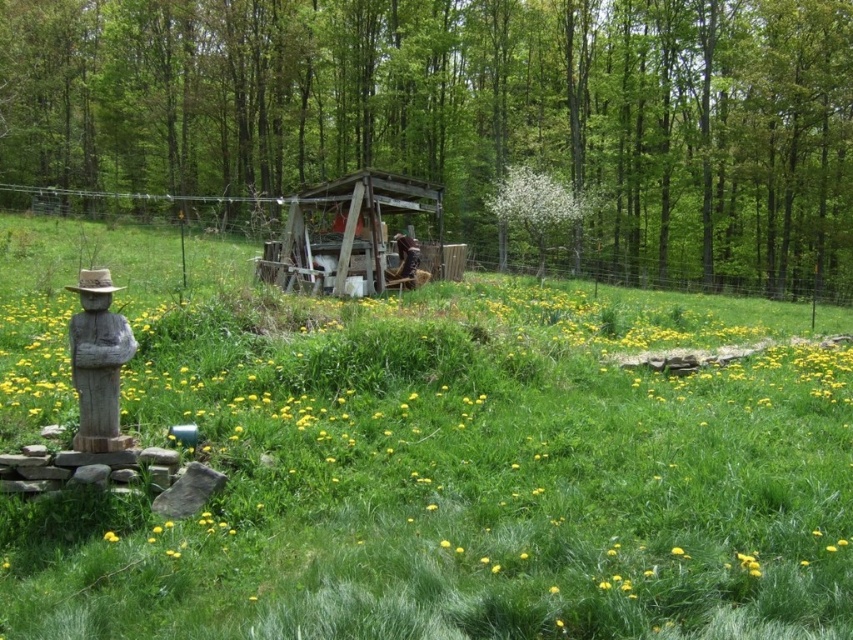
Question: Does wooden hut at center come behind yellow matte flower at center?

Choices:
 (A) no
 (B) yes

Answer: (B)

Question: Is green leafy tree at center to the left of yellow matte flower at center from the viewer's perspective?

Choices:
 (A) yes
 (B) no

Answer: (A)

Question: Which point is farther from the camera taking this photo?

Choices:
 (A) (105, 536)
 (B) (70, 20)
 (C) (109, 284)
 (D) (57, 332)

Answer: (B)

Question: Which is nearer to the straw hat at left?

Choices:
 (A) green leafy tree at center
 (B) wooden hut at center
 (C) wooden statue at left
 (D) yellow matte flower at center

Answer: (C)

Question: Does green leafy tree at center come behind straw hat at left?

Choices:
 (A) no
 (B) yes

Answer: (B)

Question: Based on their relative distances, which object is nearer to the green grass at center?

Choices:
 (A) white matte tree at upper center
 (B) wooden hut at center
 (C) green leafy tree at center

Answer: (B)